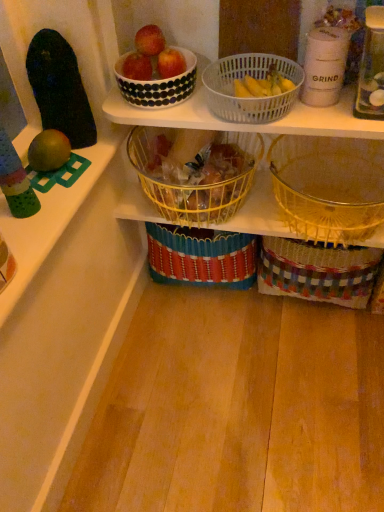
Locate an element on the screen. free space in front of glossy apple at upper center, marked as the 3th apple in a left-to-right arrangement is located at coordinates (183, 104).